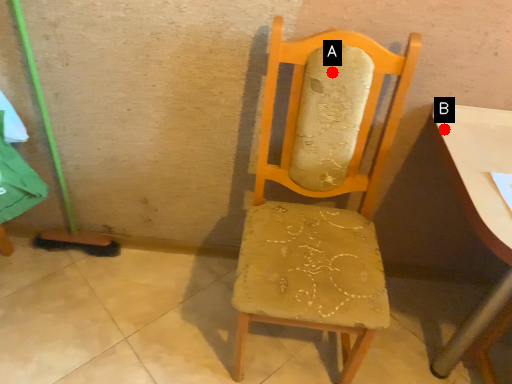
Question: Two points are circled on the image, labeled by A and B beside each circle. Which point is farther from the camera taking this photo?

Choices:
 (A) A is further
 (B) B is further

Answer: (B)